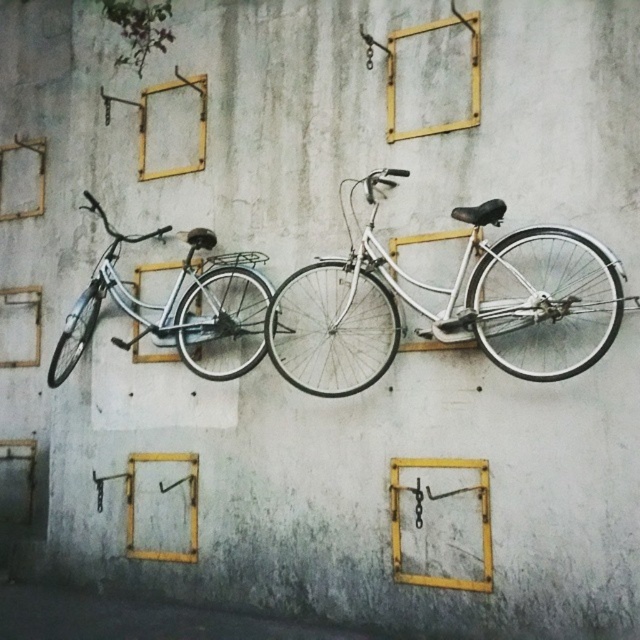
Question: Can you confirm if white metallic bicycle at center is smaller than matte white bicycle at left?

Choices:
 (A) no
 (B) yes

Answer: (A)

Question: Which of the following is the farthest from the observer?

Choices:
 (A) white metallic bicycle at center
 (B) matte white bicycle at left

Answer: (B)

Question: Does white metallic bicycle at center lie in front of matte white bicycle at left?

Choices:
 (A) yes
 (B) no

Answer: (A)

Question: Which of the following is the closest to the observer?

Choices:
 (A) matte white bicycle at left
 (B) white metallic bicycle at center

Answer: (B)

Question: Where is white metallic bicycle at center located in relation to matte white bicycle at left in the image?

Choices:
 (A) right
 (B) left

Answer: (A)